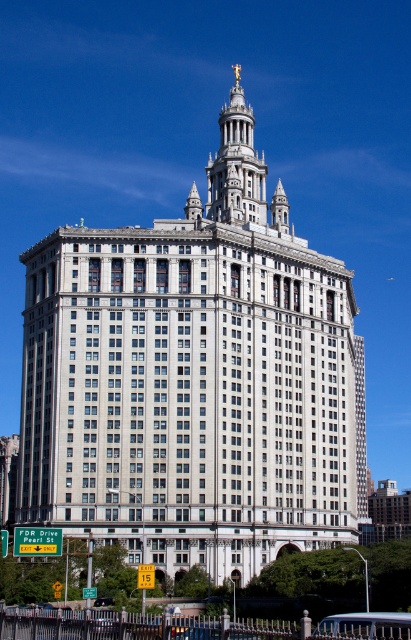
Does white stone building at center have a larger size compared to white stone tower at upper center?

Correct, white stone building at center is larger in size than white stone tower at upper center.

Which of these two, white stone building at center or white stone tower at upper center, stands shorter?

With less height is white stone tower at upper center.

Is point (261, 420) positioned after point (219, 122)?

No, (261, 420) is in front of (219, 122).

This screenshot has width=411, height=640. I want to click on white stone building at center, so click(x=193, y=378).